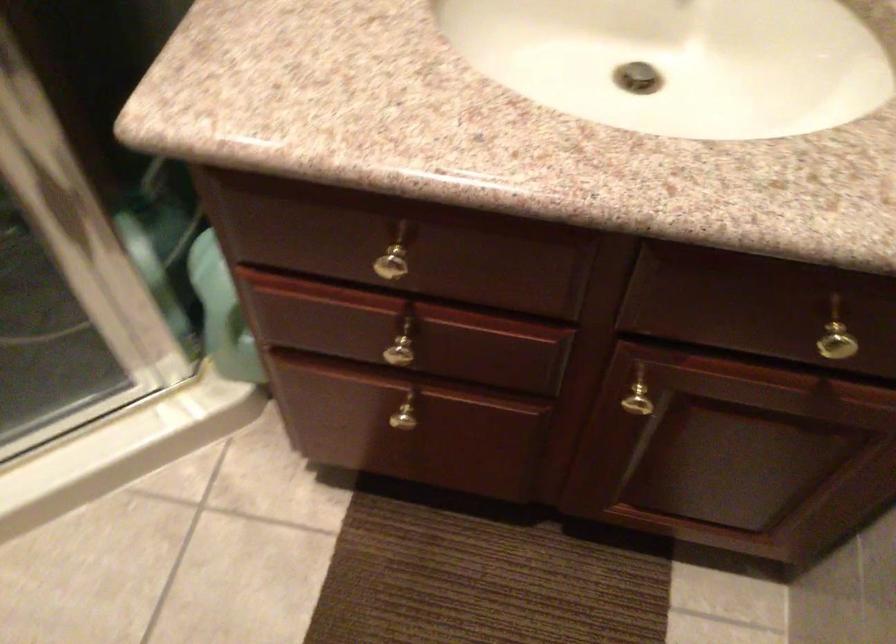
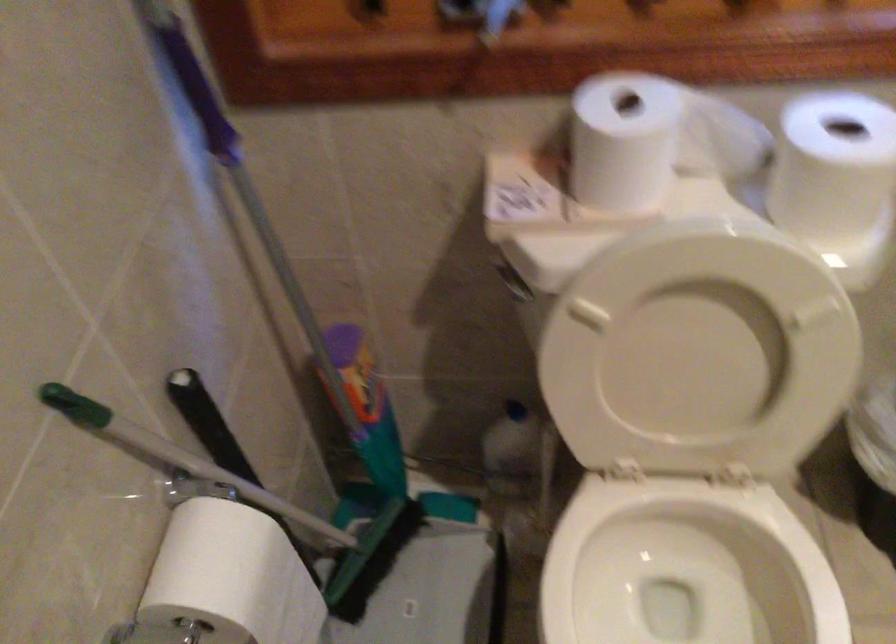
The images are taken continuously from a first-person perspective. In which direction is your viewpoint rotating?

The camera's rotation is toward left-down.